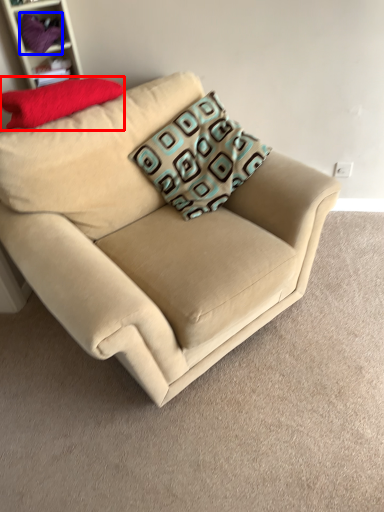
Question: Which of the following is the farthest to the observer, pillow (highlighted by a red box) or fabric (highlighted by a blue box)?

Choices:
 (A) pillow
 (B) fabric

Answer: (B)